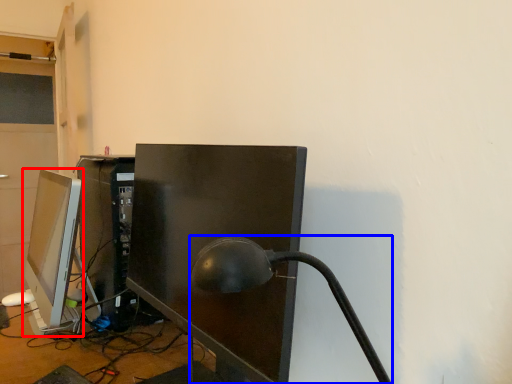
Question: Which of the following is the farthest to the observer, computer monitor (highlighted by a red box) or table lamp (highlighted by a blue box)?

Choices:
 (A) computer monitor
 (B) table lamp

Answer: (A)